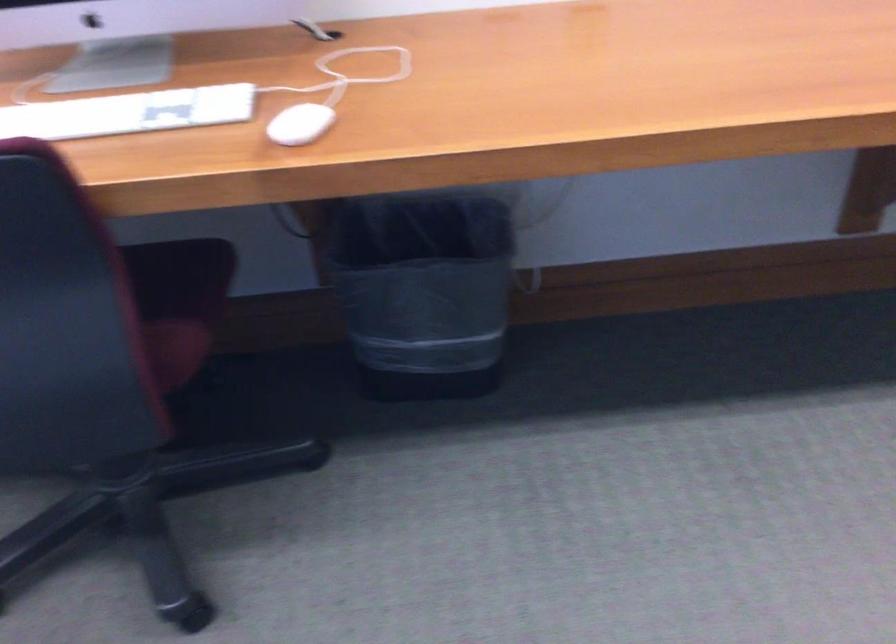
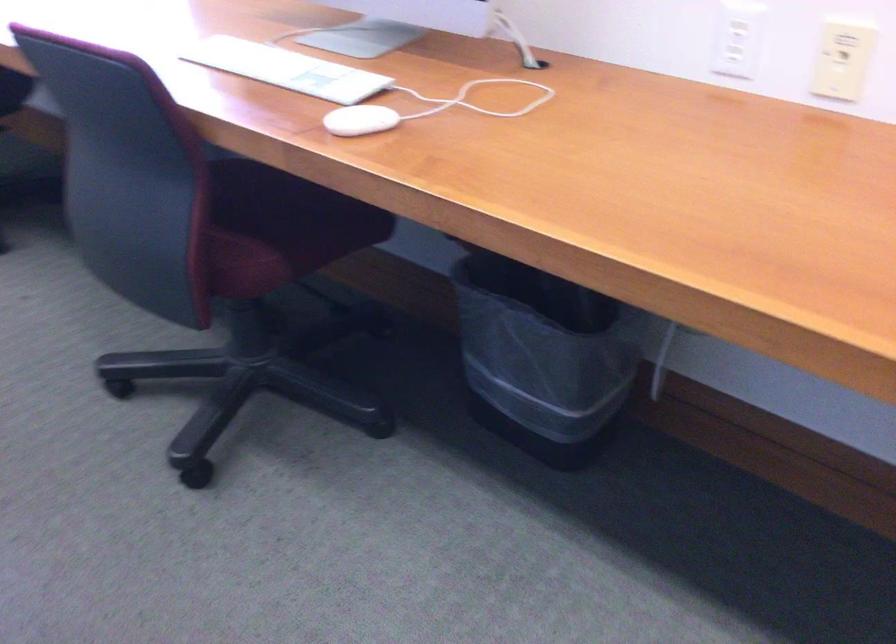
Locate, in the second image, the point that corresponds to the point at 468,294 in the first image.

(543, 357)